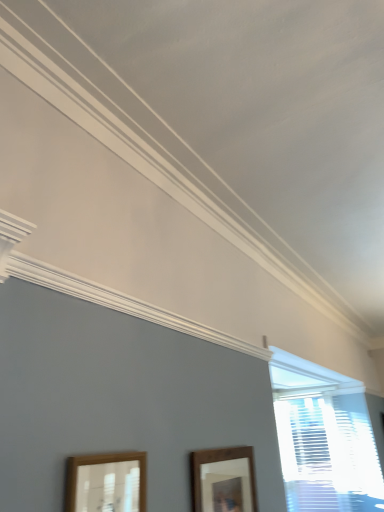
Question: Which direction should I rotate to look at brown wooden picture frame at lower center, the 2th picture frame when ordered from left to right, — up or down?

Choices:
 (A) up
 (B) down

Answer: (B)

Question: Can you confirm if brown wooden picture frame at lower center, the 1th picture frame viewed from the right, is taller than white textured blinds at right?

Choices:
 (A) no
 (B) yes

Answer: (A)

Question: Is brown wooden picture frame at lower center, which ranks as the first picture frame in back-to-front order, smaller than white textured blinds at right?

Choices:
 (A) no
 (B) yes

Answer: (B)

Question: From the image's perspective, does brown wooden picture frame at lower center, the 2th picture frame when ordered from left to right, appear lower than white textured blinds at right?

Choices:
 (A) no
 (B) yes

Answer: (A)

Question: Does brown wooden picture frame at lower center, the 2th picture frame when ordered from left to right, have a larger size compared to white textured blinds at right?

Choices:
 (A) no
 (B) yes

Answer: (A)

Question: Is brown wooden picture frame at lower center, the 2th picture frame when ordered from left to right, not near white textured blinds at right?

Choices:
 (A) yes
 (B) no

Answer: (A)

Question: Can you confirm if brown wooden picture frame at lower center, the 1th picture frame viewed from the right, is shorter than white textured blinds at right?

Choices:
 (A) yes
 (B) no

Answer: (A)

Question: Does wooden picture frame at lower left, positioned as the 2th picture frame in right-to-left order, have a greater width compared to white textured blinds at right?

Choices:
 (A) yes
 (B) no

Answer: (B)

Question: From a real-world perspective, is wooden picture frame at lower left, positioned as the 2th picture frame in right-to-left order, on white textured blinds at right?

Choices:
 (A) yes
 (B) no

Answer: (B)

Question: Would you consider wooden picture frame at lower left, positioned as the 2th picture frame in right-to-left order, to be distant from white textured blinds at right?

Choices:
 (A) no
 (B) yes

Answer: (B)

Question: Is wooden picture frame at lower left, which is counted as the 1th picture frame, starting from the front, aimed at white textured blinds at right?

Choices:
 (A) no
 (B) yes

Answer: (A)

Question: Is the depth of wooden picture frame at lower left, the 2th picture frame in the back-to-front sequence, greater than that of white textured blinds at right?

Choices:
 (A) no
 (B) yes

Answer: (A)

Question: From the image's perspective, is wooden picture frame at lower left, the 2th picture frame in the back-to-front sequence, above white textured blinds at right?

Choices:
 (A) yes
 (B) no

Answer: (A)

Question: Is white textured blinds at right at the left side of brown wooden picture frame at lower center, which ranks as the first picture frame in back-to-front order?

Choices:
 (A) no
 (B) yes

Answer: (A)